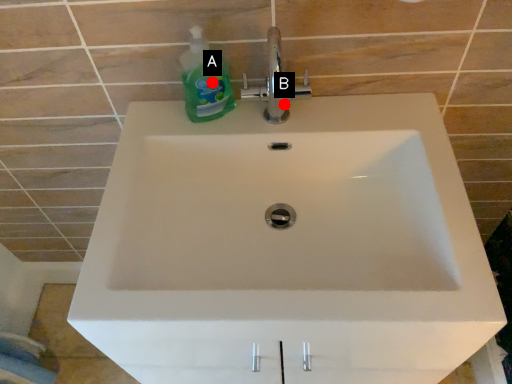
Question: Two points are circled on the image, labeled by A and B beside each circle. Which point is closer to the camera?

Choices:
 (A) A is closer
 (B) B is closer

Answer: (A)